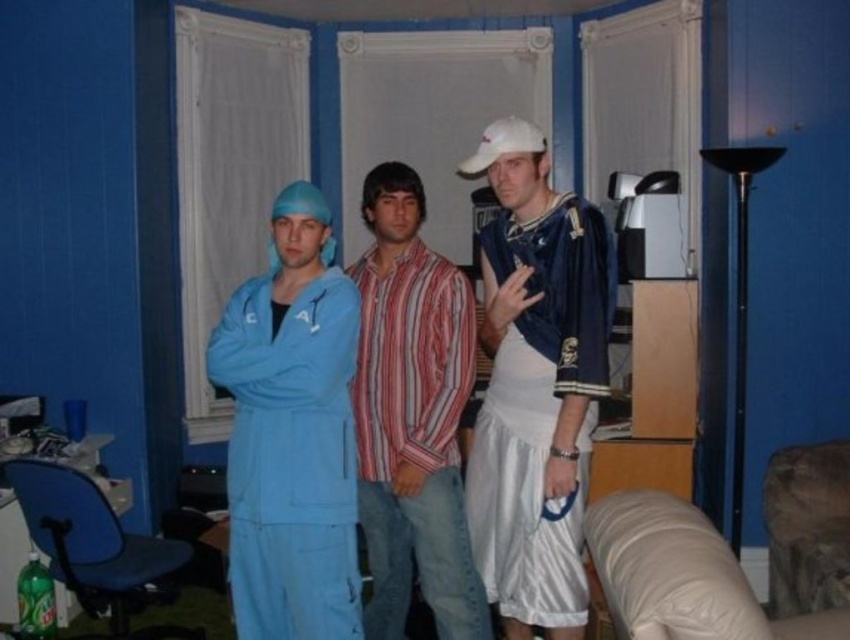
Does white matte baseball cap at upper center have a greater width compared to striped cotton shirt at center?

Incorrect, white matte baseball cap at upper center's width does not surpass striped cotton shirt at center's.

Which is more to the right, white matte baseball cap at upper center or striped cotton shirt at center?

white matte baseball cap at upper center is more to the right.

Does point (510, 353) come closer to viewer compared to point (377, 266)?

Yes, it is.

Locate an element on the screen. The width and height of the screenshot is (850, 640). white matte baseball cap at upper center is located at coordinates (536, 385).

The height and width of the screenshot is (640, 850). What are the coordinates of `light blue matte jumpsuit at center` in the screenshot? It's located at (292, 433).

Who is more forward, (605, 381) or (336, 452)?

Positioned in front is point (336, 452).

Measure the distance between white matte baseball cap at upper center and light blue matte jumpsuit at center.

The distance of white matte baseball cap at upper center from light blue matte jumpsuit at center is 22.87 inches.

Where is `white matte baseball cap at upper center`? Image resolution: width=850 pixels, height=640 pixels. white matte baseball cap at upper center is located at coordinates (536, 385).

The image size is (850, 640). In order to click on white matte baseball cap at upper center in this screenshot , I will do `click(536, 385)`.